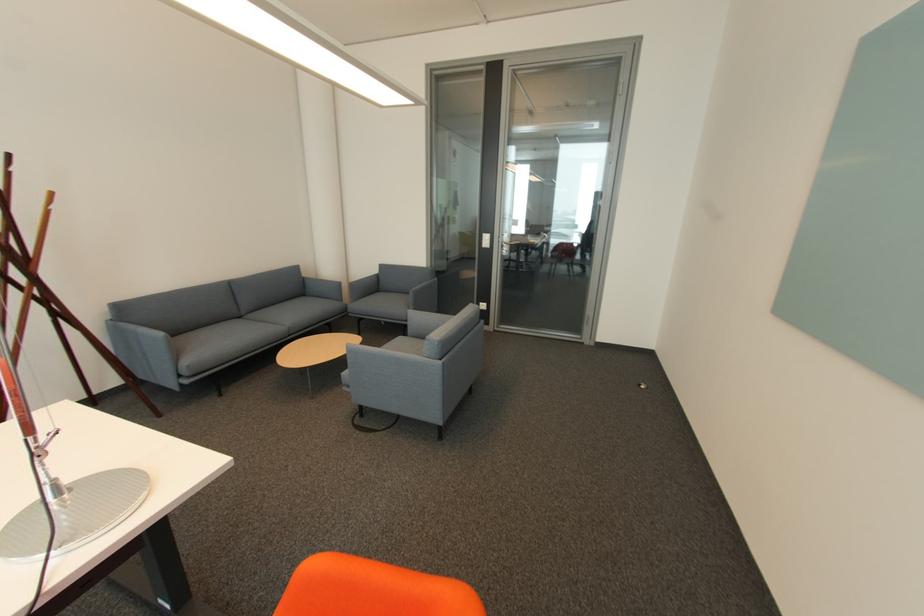
Where is `grey sofa sitting surface`? The width and height of the screenshot is (924, 616). grey sofa sitting surface is located at coordinates (226, 339).